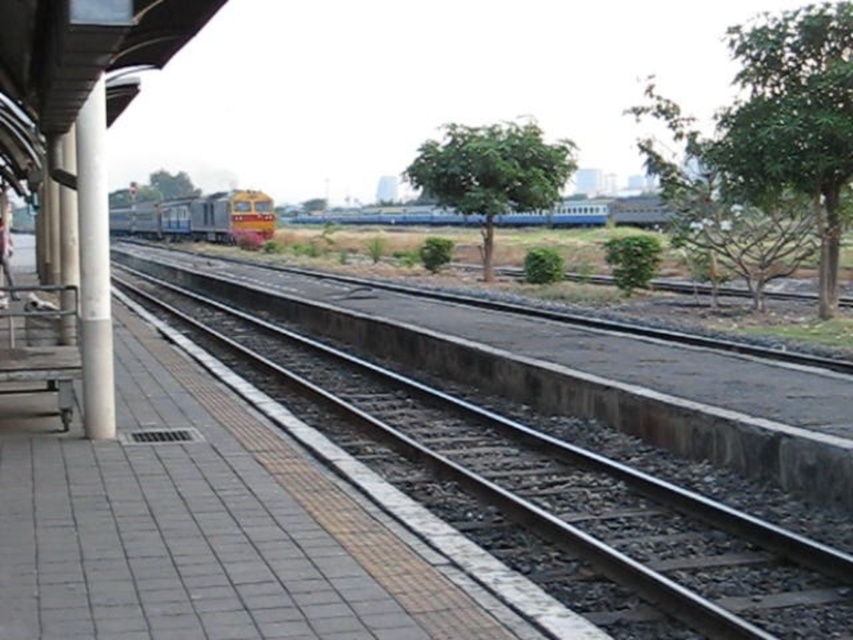
You are a passenger standing at the entrance of the station. You need to board the train located in the background. Which direction should you walk to reach the gray concrete platform at center from your current position?

The gray concrete platform at center is located at point [206,528], so you should walk towards the center of the platform to reach it.

You are standing on the gray concrete platform at center and want to walk towards the white concrete pillar at left. Is the pillar in front of you or behind you?

The white concrete pillar at left is behind the gray concrete platform at center, so when you are standing on the platform, the pillar is behind you.